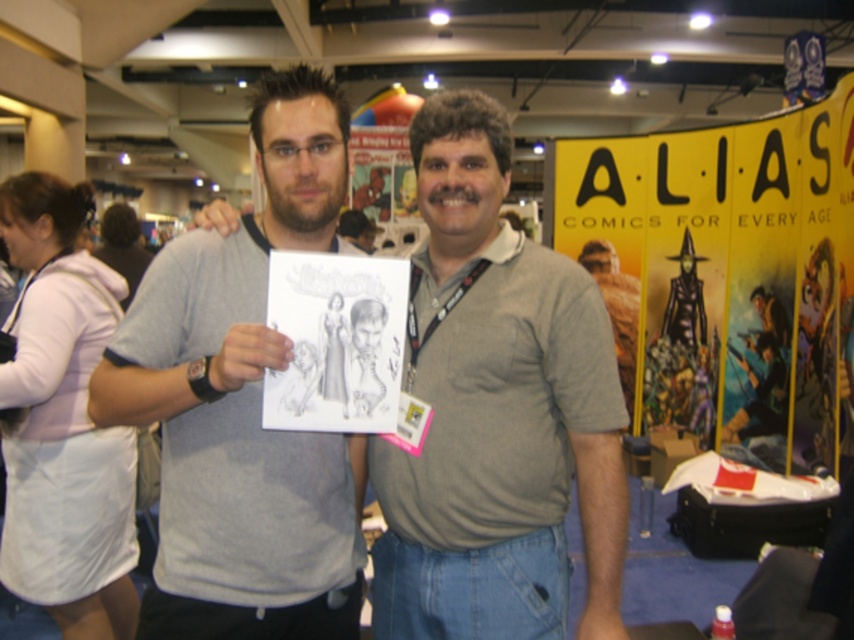
Is point (287, 182) positioned in front of point (743, 442)?

Yes.

Does gray cotton t-shirt at center appear over yellow paper poster at upper right?

No, gray cotton t-shirt at center is not above yellow paper poster at upper right.

You are a GUI agent. You are given a task and a screenshot of the screen. Output one action in this format:
    pyautogui.click(x=<x>, y=<y>)
    Task: Click on the gray cotton t-shirt at center
    This screenshot has width=854, height=640.
    Given the screenshot: What is the action you would take?
    pyautogui.click(x=243, y=404)

Does yellow paper poster at upper right have a larger size compared to graphite paper drawing at center?

Yes.

Does yellow paper poster at upper right come behind graphite paper drawing at center?

Yes, yellow paper poster at upper right is further from the viewer.

Does point (682, 332) lie behind point (291, 378)?

Yes, it is.

This screenshot has width=854, height=640. In order to click on yellow paper poster at upper right in this screenshot , I will do `click(722, 275)`.

Does gray cotton shirt at center appear on the right side of yellow paper poster at upper right?

No, gray cotton shirt at center is not to the right of yellow paper poster at upper right.

Does gray cotton shirt at center have a greater height compared to yellow paper poster at upper right?

In fact, gray cotton shirt at center may be shorter than yellow paper poster at upper right.

Is point (452, 188) in front of point (744, 336)?

That is True.

Where is `gray cotton shirt at center`? This screenshot has width=854, height=640. gray cotton shirt at center is located at coordinates (496, 412).